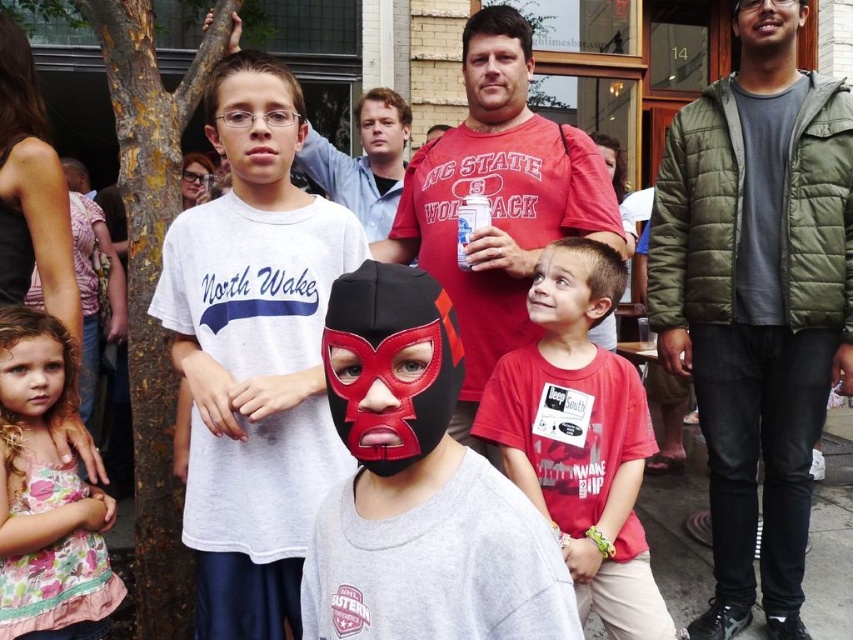
Does olive green puffer jacket at right have a greater width compared to matte black mask at center?

Yes.

At what (x,y) coordinates should I click in order to perform the action: click on olive green puffer jacket at right. Please return your answer as a coordinate pair (x, y). Looking at the image, I should click on (757, 300).

This screenshot has width=853, height=640. Identify the location of olive green puffer jacket at right. (757, 300).

Does white cotton t-shirt at center appear under matte red shirt at center?

Correct, white cotton t-shirt at center is located below matte red shirt at center.

This screenshot has height=640, width=853. What are the coordinates of `white cotton t-shirt at center` in the screenshot? It's located at (254, 355).

Locate an element on the screen. white cotton t-shirt at center is located at coordinates (254, 355).

Is matte black mask at center smaller than floral fabric dress at lower left?

No.

Describe the element at coordinates (418, 488) in the screenshot. I see `matte black mask at center` at that location.

Is point (440, 408) behind point (33, 419)?

No, it is not.

At what (x,y) coordinates should I click in order to perform the action: click on matte black mask at center. Please return your answer as a coordinate pair (x, y). Looking at the image, I should click on (418, 488).